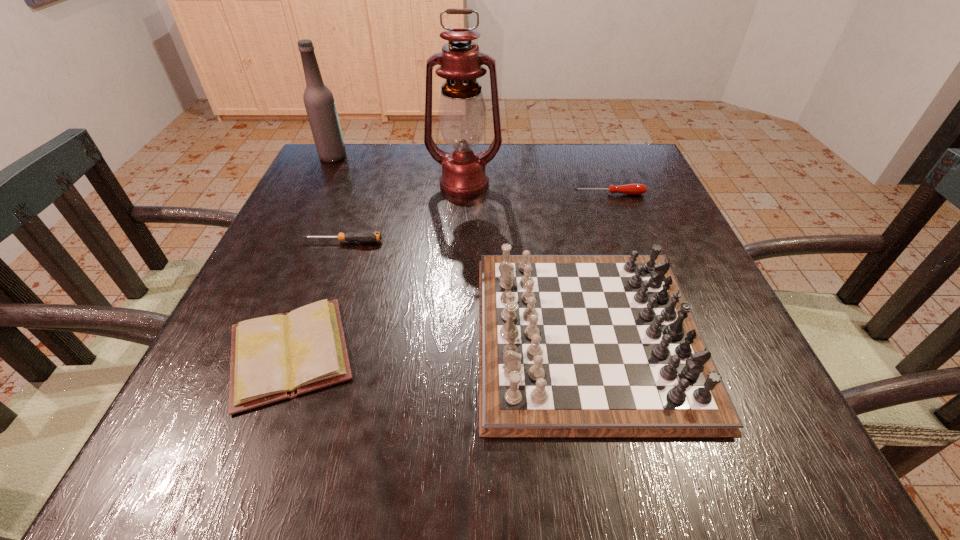
In the image, there is a desktop. Where is `vacant space at the far edge`? The height and width of the screenshot is (540, 960). vacant space at the far edge is located at coordinates (527, 150).

This screenshot has width=960, height=540. Identify the location of free spot at the near edge of the desktop. (414, 473).

Locate an element on the screen. vacant space at the right edge of the desktop is located at coordinates (654, 211).

In the image, there is a desktop. Where is `vacant area at the near left corner`? The image size is (960, 540). vacant area at the near left corner is located at coordinates (288, 424).

You are a GUI agent. You are given a task and a screenshot of the screen. Output one action in this format:
    pyautogui.click(x=<x>, y=<y>)
    Task: Click on the vacant region at the far right corner of the desktop
    Image resolution: width=960 pixels, height=540 pixels.
    Given the screenshot: What is the action you would take?
    pyautogui.click(x=581, y=151)

Where is `vacant space at the near right corner of the desktop`? The image size is (960, 540). vacant space at the near right corner of the desktop is located at coordinates (802, 448).

At what (x,y) coordinates should I click in order to perform the action: click on free space that is in between the fifth shortest object and the diary. Please return your answer as a coordinate pair (x, y). This screenshot has height=540, width=960. Looking at the image, I should click on (312, 255).

Where is `vacant region between the tallest object and the farthest object`? vacant region between the tallest object and the farthest object is located at coordinates (398, 170).

Identify the location of blank region between the chessboard and the second tallest object. This screenshot has width=960, height=540. (460, 245).

Find the location of a particular element. This screenshot has width=960, height=540. vacant space in between the farthest object and the tallest object is located at coordinates (398, 170).